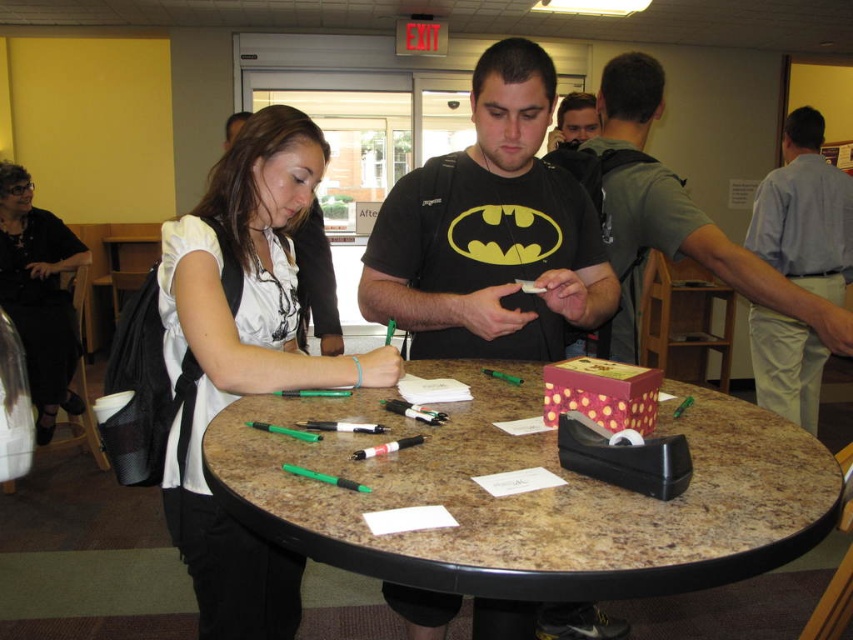
You are standing at a distance of 81.01 centimeters from the point marked at coordinates point (473, 492) in the image. If you want to move closer to this point, which direction should you move in relation to the table?

Since you are currently 81.01 centimeters away from the point marked at coordinates point (473, 492), you should move forward towards the table to get closer to the point.

You are organizing a meeting and need to place the green matte pen at center and the black fabric dress at upper left on a shelf. The shelf has a height limit of 10 cm. Can both items fit on the shelf without exceeding the height limit?

The green matte pen at center has a lesser height compared to black fabric dress at upper left. Since the shelf has a height limit of 10 cm, both items can fit on the shelf as long as the taller item, the black fabric dress at upper left, is under or exactly 10 cm in height.